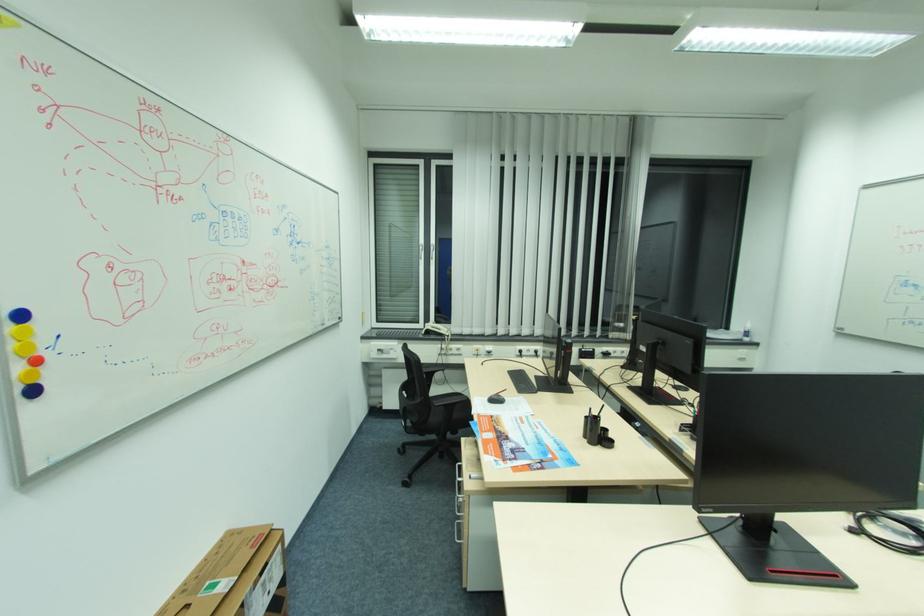
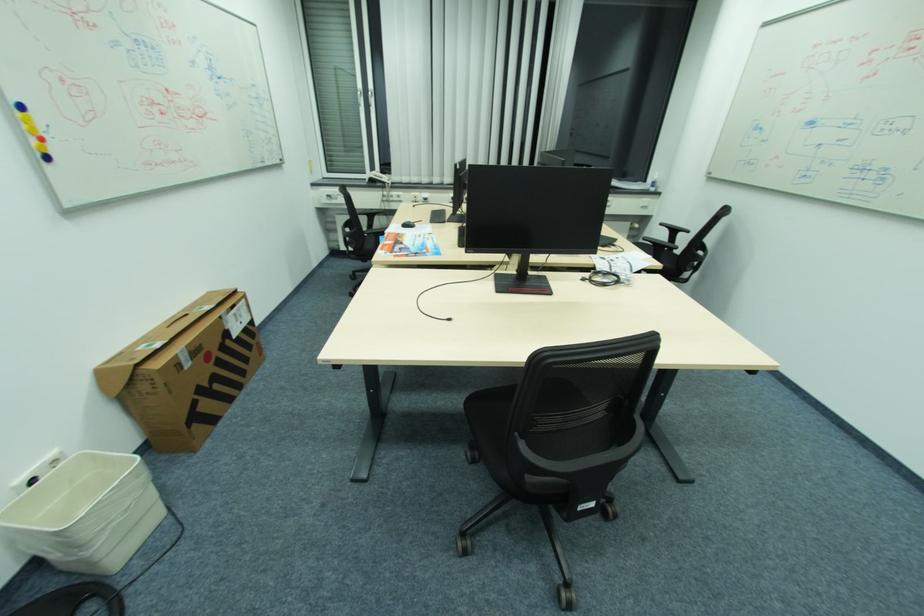
Find the pixel in the second image that matches (385,398) in the first image.

(343, 241)